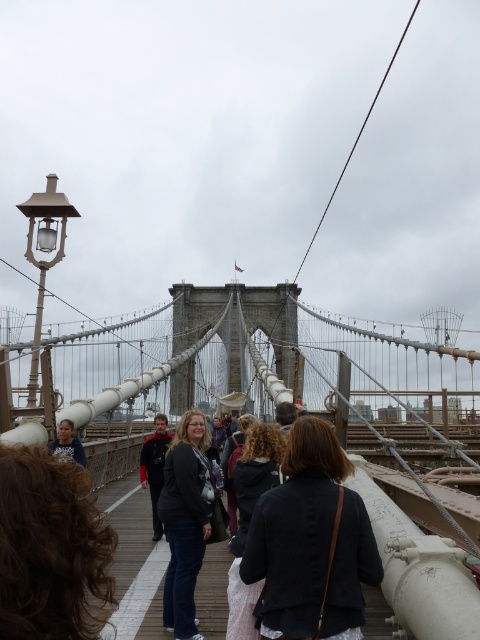
Question: Observing the image, what is the correct spatial positioning of gray concrete suspension bridge at center in reference to matte black jacket at left?

Choices:
 (A) right
 (B) left

Answer: (A)

Question: Which point is closer to the camera taking this photo?

Choices:
 (A) (69, 420)
 (B) (385, 634)

Answer: (B)

Question: Among these points, which one is nearest to the camera?

Choices:
 (A) (157, 428)
 (B) (191, 465)
 (C) (110, 529)

Answer: (C)

Question: Which object is the farthest from the dark brown leather jacket at center?

Choices:
 (A) gray concrete suspension bridge at center
 (B) dark gray sweater at center
 (C) dark blue jacket at center
 (D) dark brown curly hair at center

Answer: (D)

Question: Is dark blue jacket at center in front of dark brown curly hair at center?

Choices:
 (A) no
 (B) yes

Answer: (A)

Question: Can you confirm if dark blue jacket at center is positioned to the right of dark gray fabric jacket at center?

Choices:
 (A) yes
 (B) no

Answer: (A)